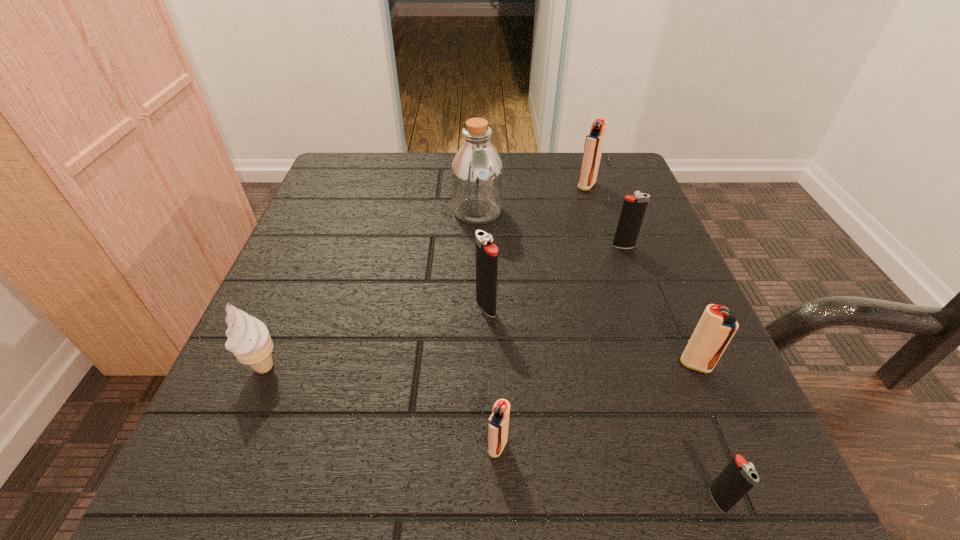
This screenshot has height=540, width=960. Identify the location of free region at the left edge. (324, 269).

In the image, there is a desktop. Identify the location of vacant area at the right edge. (612, 344).

Image resolution: width=960 pixels, height=540 pixels. I want to click on vacant area at the far left corner of the desktop, so click(386, 160).

Where is `free space at the far right corner`? free space at the far right corner is located at coordinates (614, 161).

Locate an element on the screen. The width and height of the screenshot is (960, 540). free spot between the farthest igniter and the second smallest red igniter is located at coordinates (641, 275).

In order to click on free area in between the icecream and the second smallest black igniter in this screenshot , I will do `click(444, 306)`.

Image resolution: width=960 pixels, height=540 pixels. Find the location of `vacant area that lies between the second farthest igniter and the rightmost object`. vacant area that lies between the second farthest igniter and the rightmost object is located at coordinates pos(660,306).

At what (x,y) coordinates should I click in order to perform the action: click on vacant region between the second smallest black igniter and the leftmost object. Please return your answer as a coordinate pair (x, y). The image size is (960, 540). Looking at the image, I should click on (444, 306).

At what (x,y) coordinates should I click in order to perform the action: click on empty space between the smallest black igniter and the farthest object. Please return your answer as a coordinate pair (x, y). This screenshot has height=540, width=960. Looking at the image, I should click on (652, 342).

At what (x,y) coordinates should I click in order to perform the action: click on vacant space in between the fifth nearest igniter and the icecream. Please return your answer as a coordinate pair (x, y). Image resolution: width=960 pixels, height=540 pixels. Looking at the image, I should click on (444, 306).